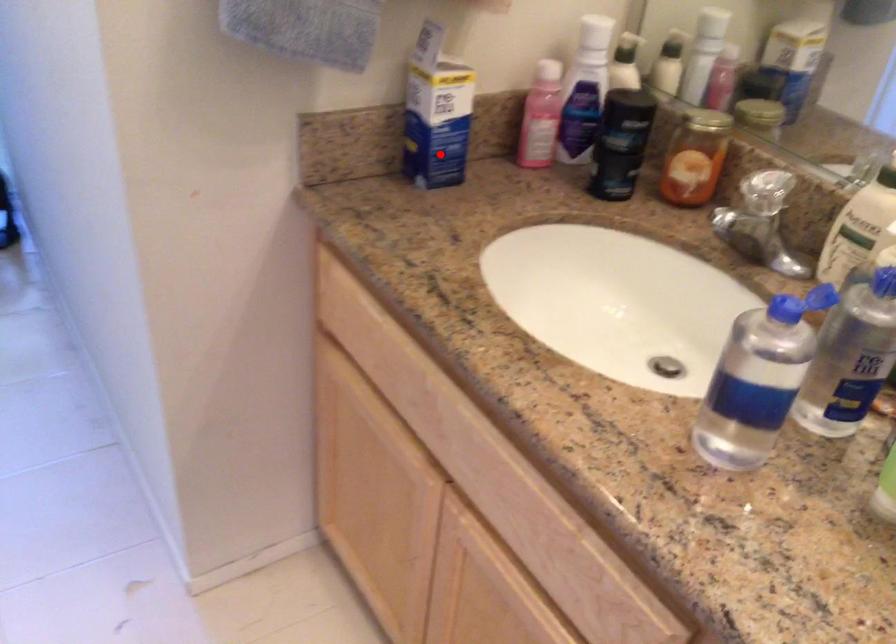
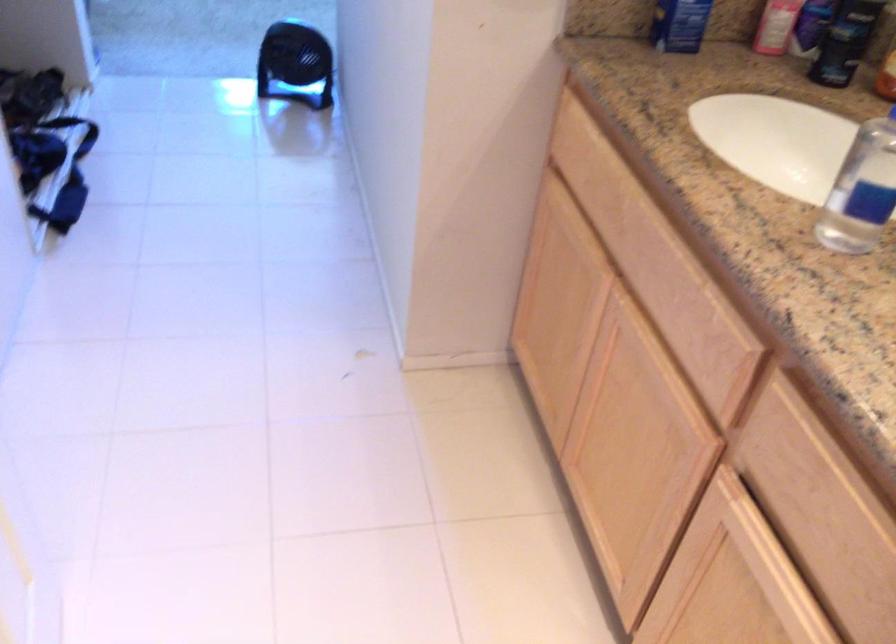
Where in the second image is the point corresponding to the highlighted location from the first image?

(679, 24)